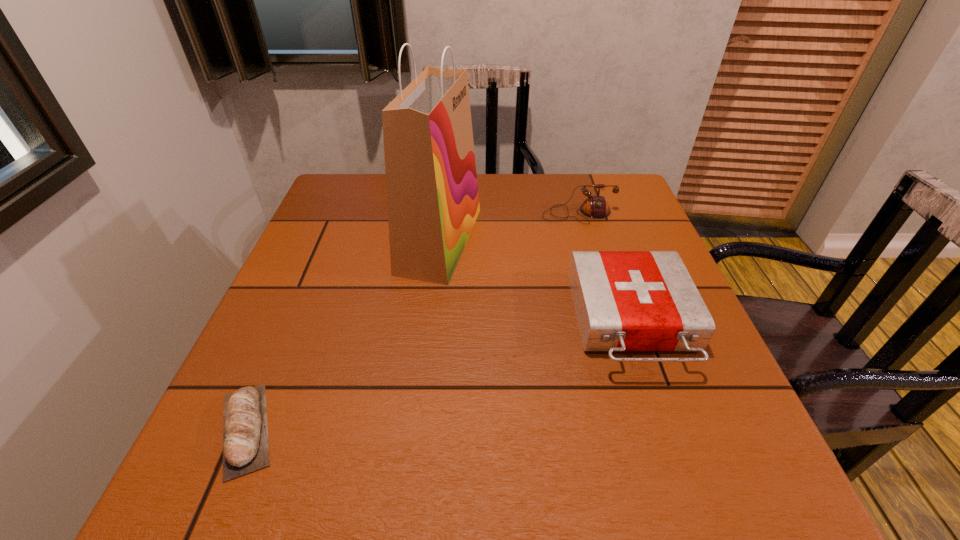
Find the location of a particular element. The width and height of the screenshot is (960, 540). vacant area that lies between the telephone and the shopping bag is located at coordinates (509, 227).

Identify the location of free space that is in between the shortest object and the first-aid kit. (439, 375).

Identify which object is located as the second nearest to the tallest object. Please provide its 2D coordinates. Your answer should be formatted as a tuple, i.e. [(x, y)], where the tuple contains the x and y coordinates of a point satisfying the conditions above.

[(624, 300)]

Find the location of a particular element. The width and height of the screenshot is (960, 540). the closest object to the first-aid kit is located at coordinates (595, 206).

Where is `vacant space that satisfies the following two spatial constraints: 1. on the back side of the pita bread; 2. on the right side of the second object from left to right`? vacant space that satisfies the following two spatial constraints: 1. on the back side of the pita bread; 2. on the right side of the second object from left to right is located at coordinates (326, 240).